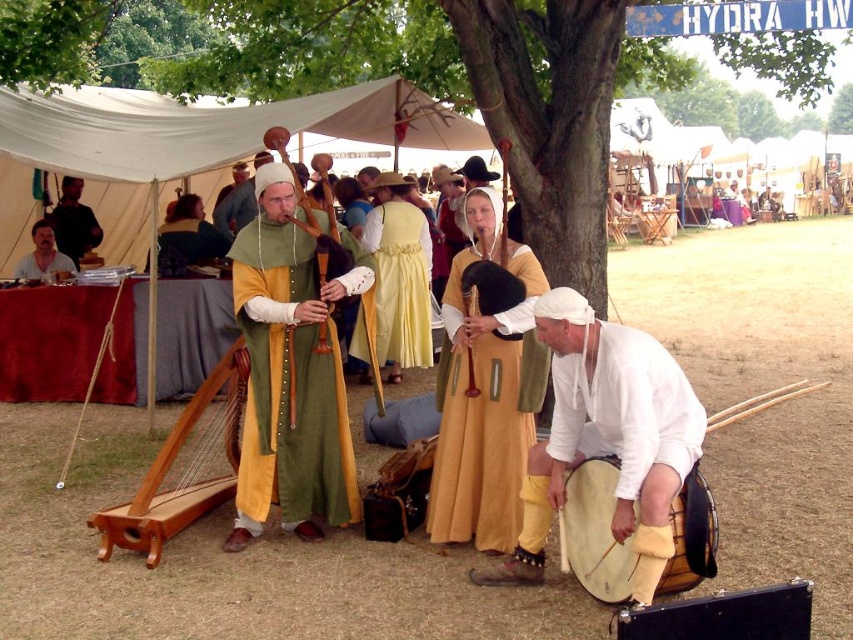
You are a photographer at the medieval festival. You want to capture a photo of the green woolen tunic at center and the white matte drum at lower right. Which object is closer to the camera?

The white matte drum at lower right is positioned under the green woolen tunic at center, meaning it is closer to the camera.

From the picture: You are standing at the center of the image and want to find the matte yellow dress at center. According to the coordinates provided, in which direction should you look to locate it?

The matte yellow dress at center is located at coordinates point (x=485, y=392), which means you should look to the center of the image to find it.